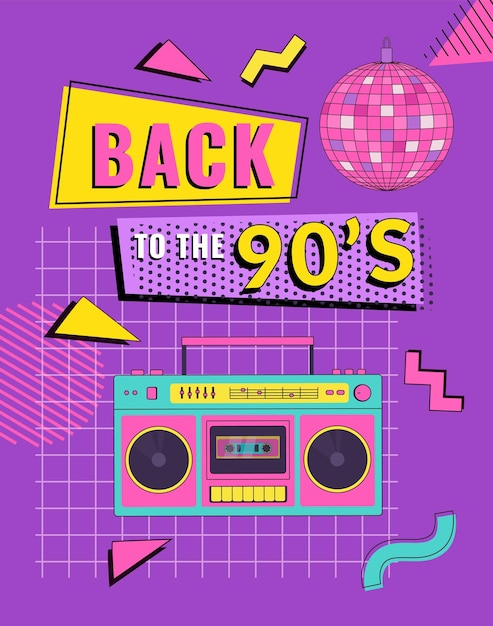
This screenshot has height=626, width=493. I want to click on disco ball, so click(x=377, y=130).